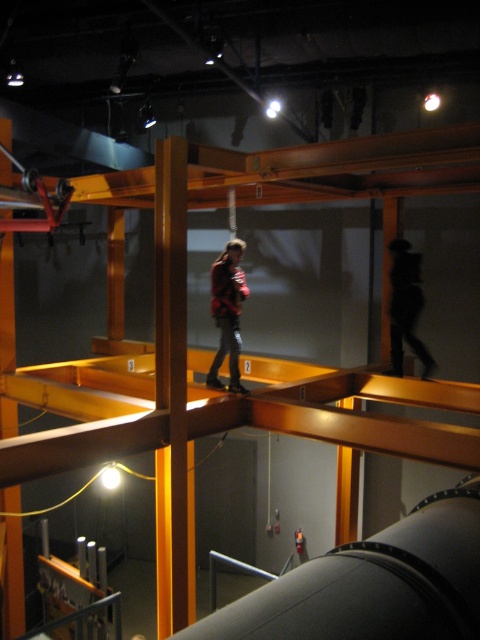
Question: Is red plaid shirt at center behind black matte cat at upper center?

Choices:
 (A) no
 (B) yes

Answer: (A)

Question: Is red plaid shirt at center above black matte cat at upper center?

Choices:
 (A) yes
 (B) no

Answer: (B)

Question: Which point appears closest to the camera in this image?

Choices:
 (A) (422, 342)
 (B) (236, 380)

Answer: (B)

Question: Is red plaid shirt at center positioned behind black matte cat at upper center?

Choices:
 (A) no
 (B) yes

Answer: (A)